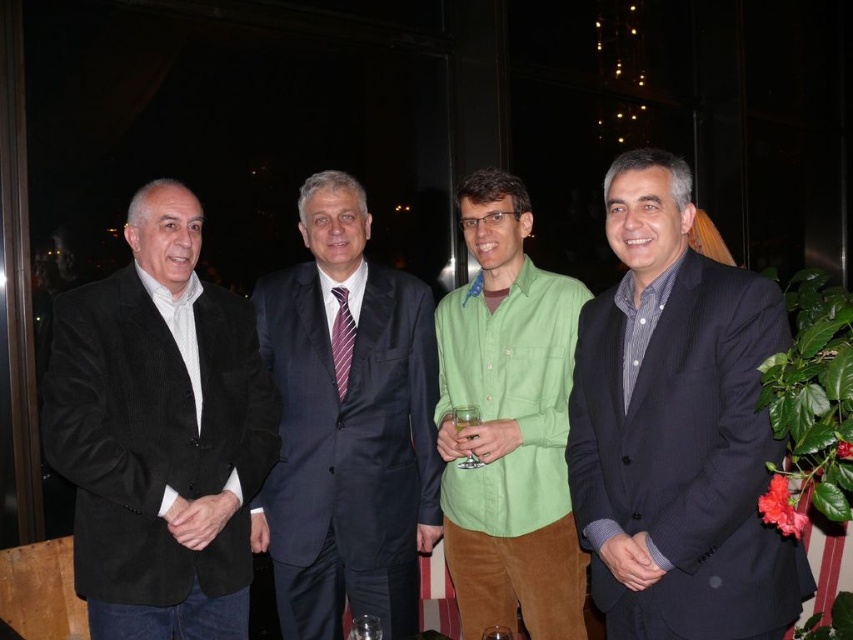
Question: Does black corduroy blazer at left lie behind transparent glass at center?

Choices:
 (A) yes
 (B) no

Answer: (A)

Question: Where is clear glass at center located in relation to clear glass wine glass at center in the image?

Choices:
 (A) left
 (B) right

Answer: (B)

Question: Can you confirm if black corduroy blazer at left is positioned to the right of transparent glass at center?

Choices:
 (A) no
 (B) yes

Answer: (A)

Question: Based on their relative distances, which object is farther from the purple striped tie at center?

Choices:
 (A) green corduroy pants at center
 (B) dark blue pinstripe suit at center
 (C) transparent glass at center

Answer: (B)

Question: Which point is farther to the camera?

Choices:
 (A) (368, 636)
 (B) (743, 408)
 (C) (511, 637)
 (D) (567, 323)

Answer: (D)

Question: Among these objects, which one is nearest to the camera?

Choices:
 (A) dark blue suit at center
 (B) purple striped tie at center

Answer: (A)